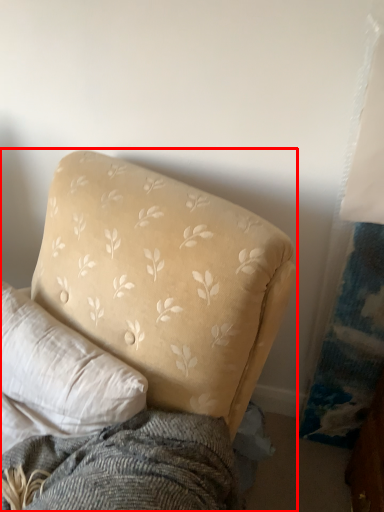
Question: In this image, where is studio couch (annotated by the red box) located relative to pillow?

Choices:
 (A) left
 (B) right

Answer: (B)